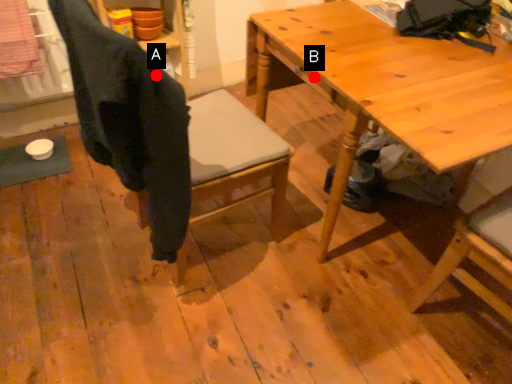
Question: Two points are circled on the image, labeled by A and B beside each circle. Which of the following is the farthest from the observer?

Choices:
 (A) A is further
 (B) B is further

Answer: (B)